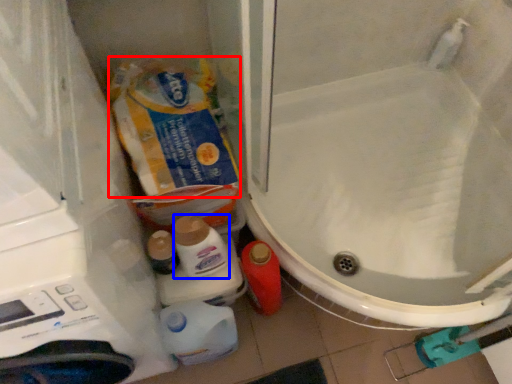
Question: Which point is closer to the camera, product (highlighted by a red box) or cleaning product (highlighted by a blue box)?

Choices:
 (A) product
 (B) cleaning product

Answer: (B)